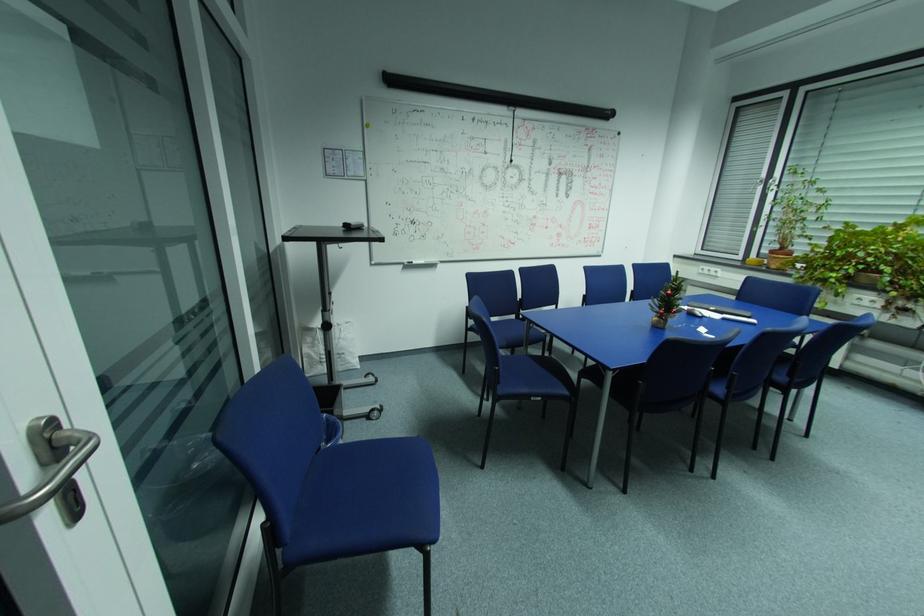
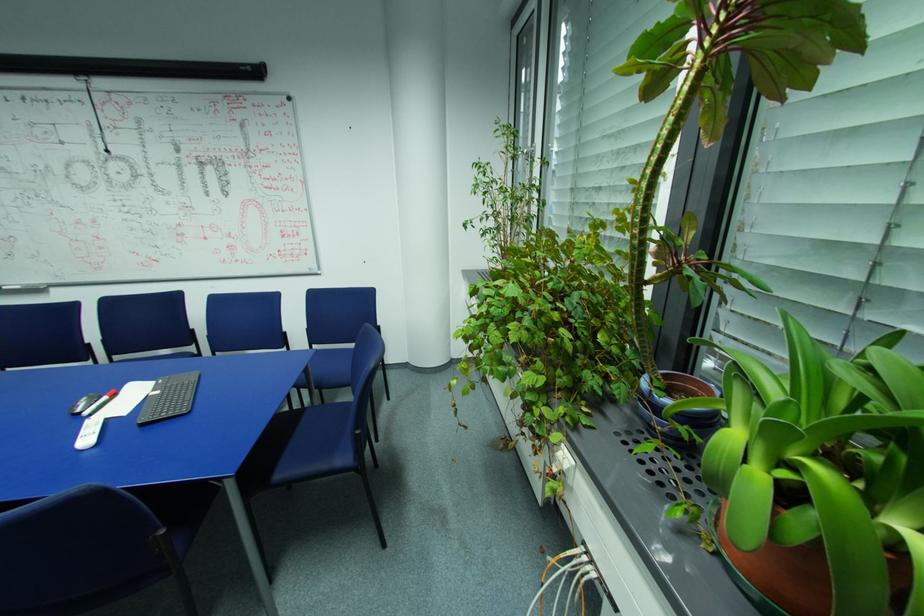
What movement of the cameraman would produce the second image?

The cameraman moved toward right, forward.